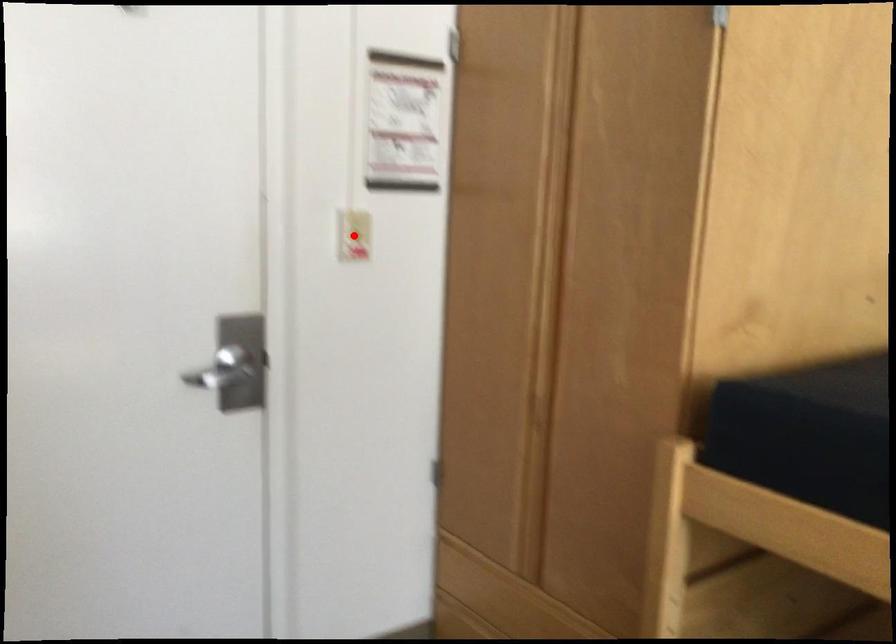
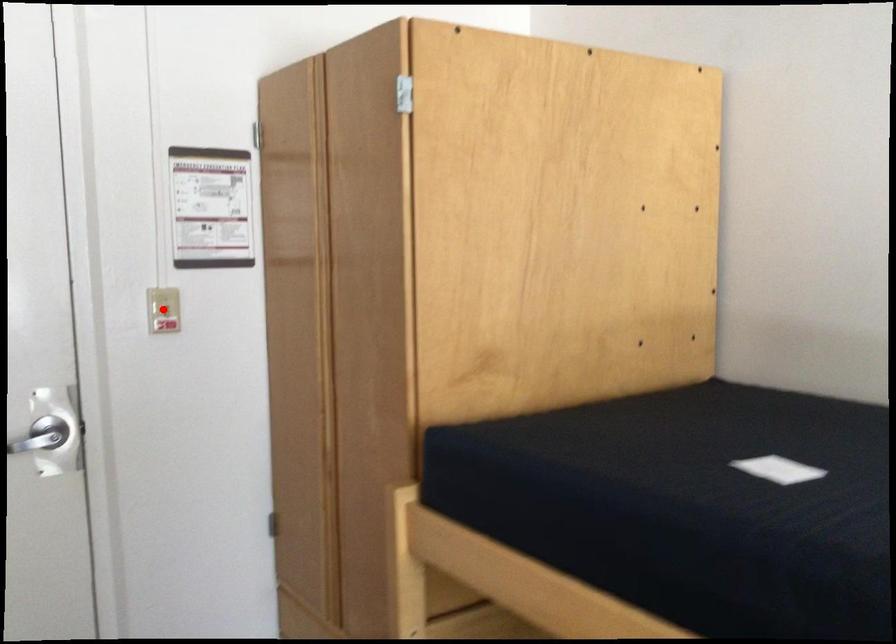
I am providing you with two images of the same scene from different viewpoints. A red point is marked on the first image and another point is marked on the second image. Do the highlighted points in image1 and image2 indicate the same real-world spot?

Yes